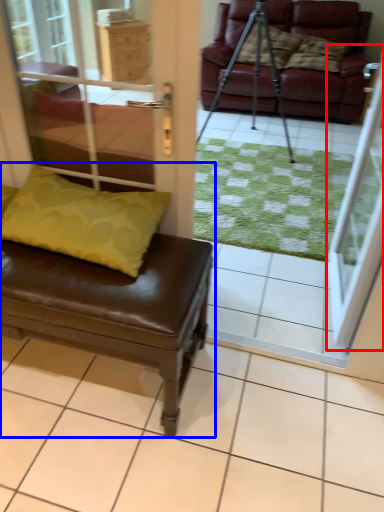
Question: Which object appears closest to the camera in this image, screen door (highlighted by a red box) or studio couch (highlighted by a blue box)?

Choices:
 (A) screen door
 (B) studio couch

Answer: (B)